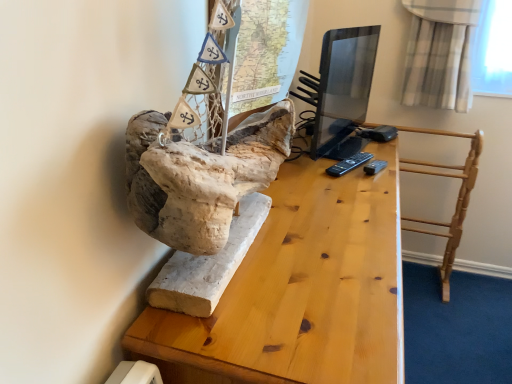
Question: Does light wood/rough table at center come behind natural wood table at center?

Choices:
 (A) no
 (B) yes

Answer: (B)

Question: From the image's perspective, is light wood/rough table at center on natural wood table at center?

Choices:
 (A) no
 (B) yes

Answer: (B)

Question: Is natural wood table at center at the back of light wood/rough table at center?

Choices:
 (A) yes
 (B) no

Answer: (B)

Question: Does light wood/rough table at center have a smaller size compared to natural wood table at center?

Choices:
 (A) yes
 (B) no

Answer: (A)

Question: From a real-world perspective, is light wood/rough table at center physically below natural wood table at center?

Choices:
 (A) no
 (B) yes

Answer: (A)

Question: Relative to natural wood table at center, is matte black monitor at center in front or behind?

Choices:
 (A) behind
 (B) front

Answer: (A)

Question: Based on their sizes in the image, would you say matte black monitor at center is bigger or smaller than natural wood table at center?

Choices:
 (A) small
 (B) big

Answer: (A)

Question: In the image, is matte black monitor at center on the left side or the right side of natural wood table at center?

Choices:
 (A) right
 (B) left

Answer: (A)

Question: Looking at their shapes, would you say matte black monitor at center is wider or thinner than natural wood table at center?

Choices:
 (A) wide
 (B) thin

Answer: (B)

Question: Is natural wood table at center taller or shorter than light wood/rough table at center?

Choices:
 (A) tall
 (B) short

Answer: (A)

Question: Is natural wood table at center inside the boundaries of light wood/rough table at center, or outside?

Choices:
 (A) outside
 (B) inside

Answer: (A)

Question: Relative to light wood/rough table at center, is natural wood table at center in front or behind?

Choices:
 (A) front
 (B) behind

Answer: (A)

Question: Is natural wood table at center bigger or smaller than light wood/rough table at center?

Choices:
 (A) small
 (B) big

Answer: (B)

Question: From the image's perspective, relative to light wood/rough table at center, is matte black monitor at center above or below?

Choices:
 (A) above
 (B) below

Answer: (A)

Question: In the image, is matte black monitor at center positioned in front of or behind light wood/rough table at center?

Choices:
 (A) front
 (B) behind

Answer: (A)